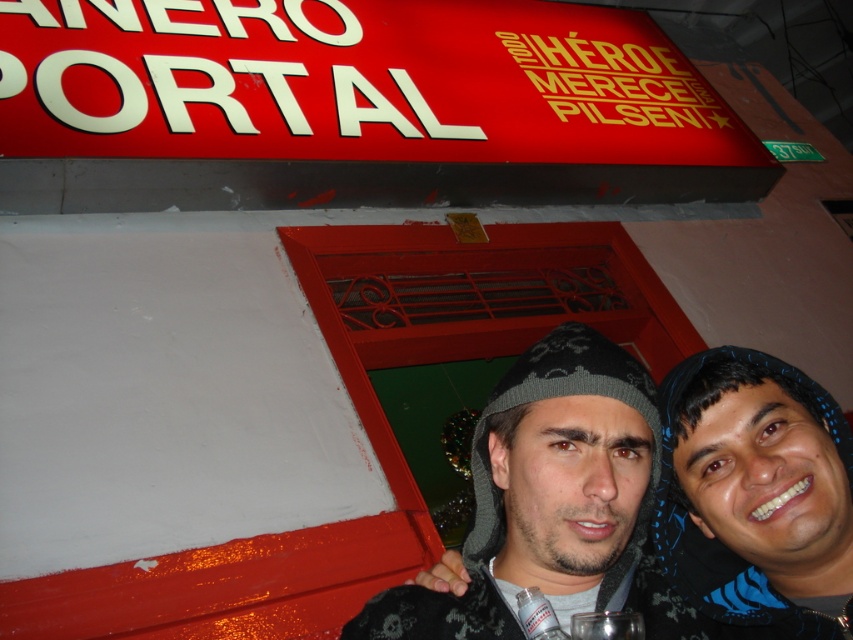
Question: Which of the following is the farthest from the observer?

Choices:
 (A) (631, 611)
 (B) (560, 545)
 (C) (717, 582)

Answer: (C)

Question: Which object is positioned farthest from the clear glass wine glass at center?

Choices:
 (A) dark gray knit cap at center
 (B) blue knit cap at center

Answer: (B)

Question: Is blue knit cap at center wider than dark gray knit cap at center?

Choices:
 (A) yes
 (B) no

Answer: (B)

Question: Which object is positioned closest to the dark gray knit cap at center?

Choices:
 (A) clear glass wine glass at center
 (B) blue knit cap at center

Answer: (B)

Question: Is blue knit cap at center bigger than clear glass wine glass at center?

Choices:
 (A) yes
 (B) no

Answer: (A)

Question: Where is dark gray knit cap at center located in relation to clear glass wine glass at center in the image?

Choices:
 (A) right
 (B) left

Answer: (A)